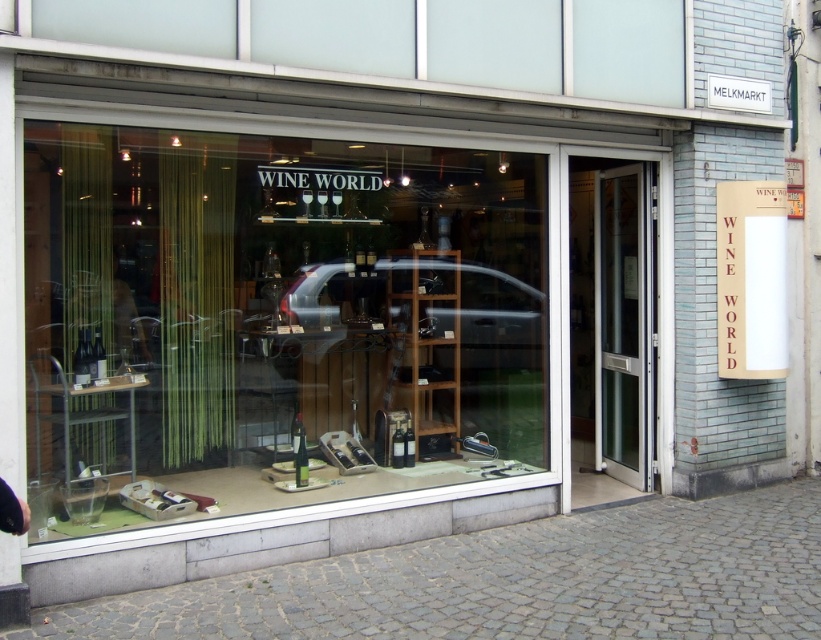
Between gray cobblestone pavement at lower center and transparent glass door at center, which one appears on the left side from the viewer's perspective?

From the viewer's perspective, gray cobblestone pavement at lower center appears more on the left side.

Measure the distance between point [764,547] and camera.

The distance of point [764,547] from camera is 16.92 feet.

Locate an element on the screen. This screenshot has width=821, height=640. gray cobblestone pavement at lower center is located at coordinates (516, 580).

Between clear glass wine bottles at center and transparent glass door at center, which one appears on the left side from the viewer's perspective?

clear glass wine bottles at center is more to the left.

How far apart are clear glass wine bottles at center and transparent glass door at center?

clear glass wine bottles at center is 1.96 meters away from transparent glass door at center.

This screenshot has width=821, height=640. Describe the element at coordinates (273, 321) in the screenshot. I see `clear glass wine bottles at center` at that location.

At what (x,y) coordinates should I click in order to perform the action: click on clear glass wine bottles at center. Please return your answer as a coordinate pair (x, y). Looking at the image, I should click on (273, 321).

Based on the photo, which of these two, clear glass wine bottles at center or gray cobblestone pavement at lower center, stands taller?

clear glass wine bottles at center is taller.

Describe the element at coordinates (273, 321) in the screenshot. The image size is (821, 640). I see `clear glass wine bottles at center` at that location.

You are a GUI agent. You are given a task and a screenshot of the screen. Output one action in this format:
    pyautogui.click(x=<x>, y=<y>)
    Task: Click on the clear glass wine bottles at center
    The height and width of the screenshot is (640, 821).
    Given the screenshot: What is the action you would take?
    pyautogui.click(x=273, y=321)